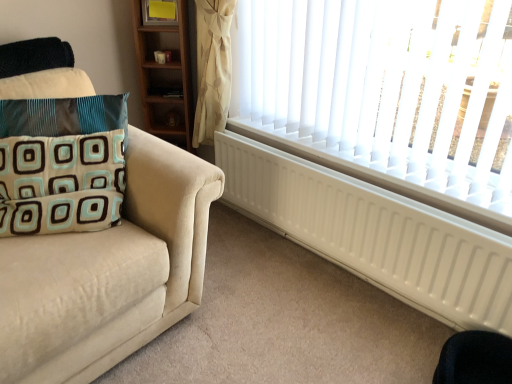
This screenshot has height=384, width=512. Identify the location of vacant space behind black fabric swivel chair at lower right. (404, 338).